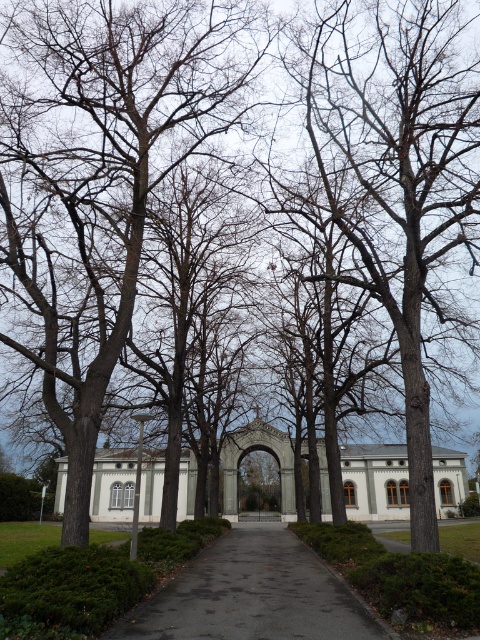
Between bare wood tree at center and dark asphalt path at center, which one has more height?

bare wood tree at center is taller.

Can you confirm if bare wood tree at center is positioned to the right of dark asphalt path at center?

Yes, bare wood tree at center is to the right of dark asphalt path at center.

The height and width of the screenshot is (640, 480). I want to click on bare wood tree at center, so click(x=398, y=177).

Image resolution: width=480 pixels, height=640 pixels. What are the coordinates of `bare wood tree at center` in the screenshot? It's located at (398, 177).